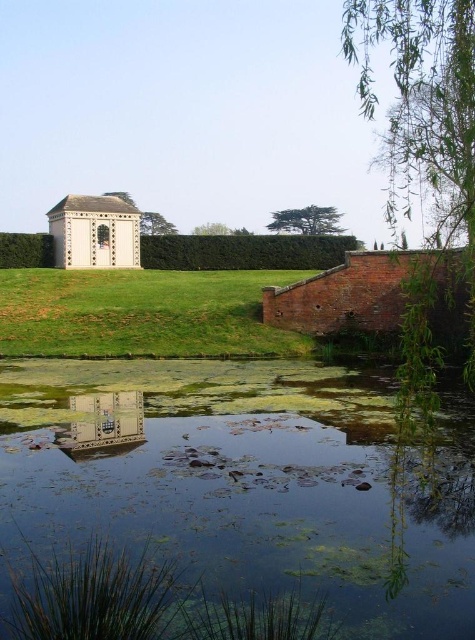
Does clear water at pond center lie behind green grassy at center?

That is False.

Which is behind, point (408, 509) or point (112, 294)?

Point (112, 294)

Which is behind, point (150, 396) or point (154, 316)?

Positioned behind is point (154, 316).

Locate an element on the screen. clear water at pond center is located at coordinates pos(245,483).